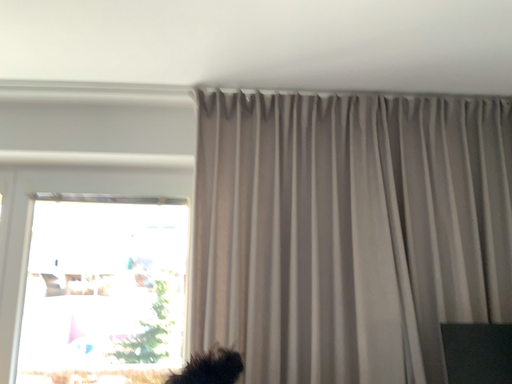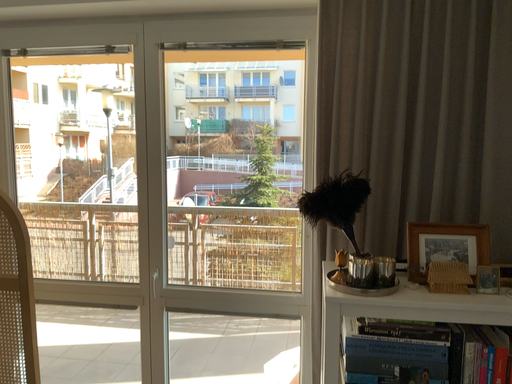
Question: Which way did the camera rotate in the video?

Choices:
 (A) rotated right
 (B) rotated left

Answer: (B)